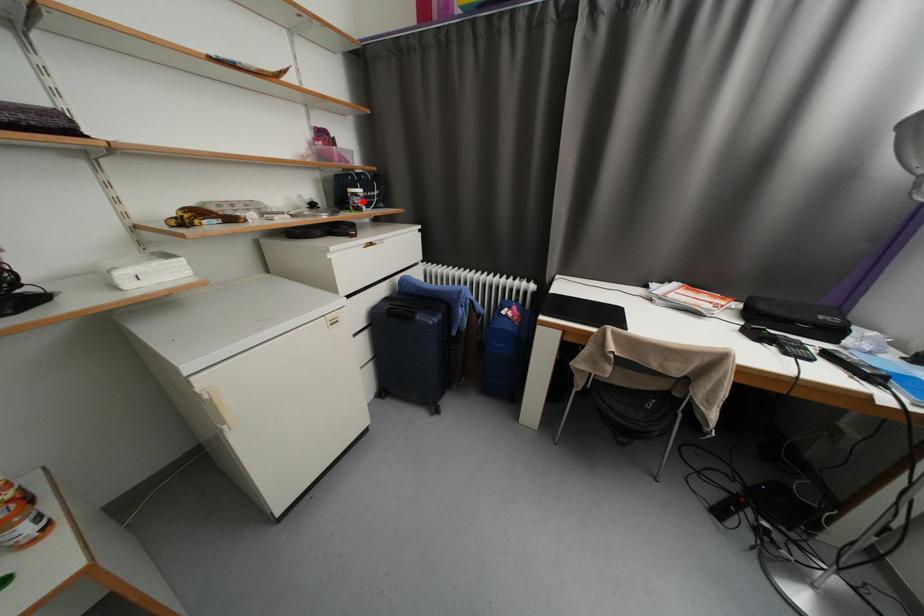
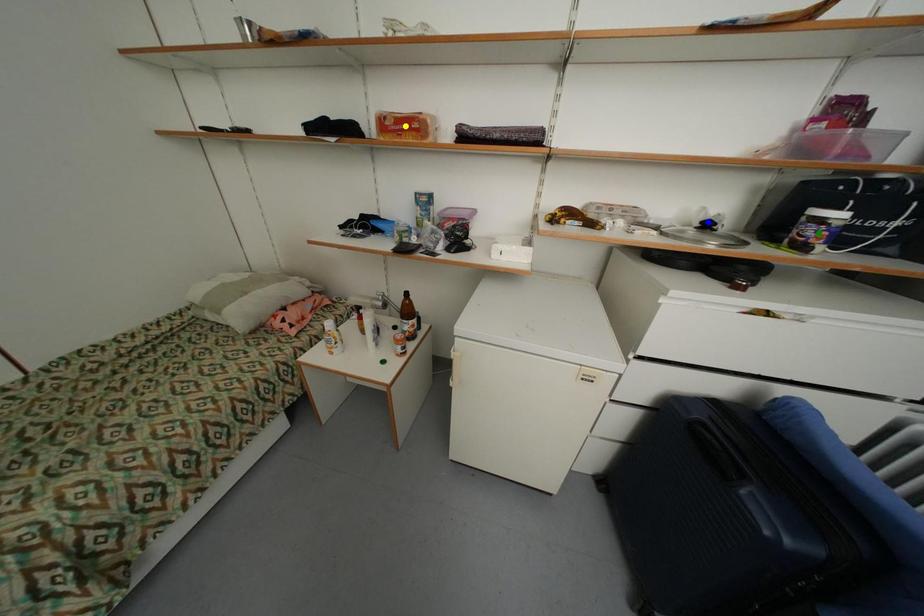
Question: I am providing you with two images of the same scene from different viewpoints. A red point is marked on the first image. You are given multiple points on the second image. Can you choose the point in image 2 that corresponds to the point in image 1?

Choices:
 (A) yellow point
 (B) green point
 (C) blue point

Answer: (B)